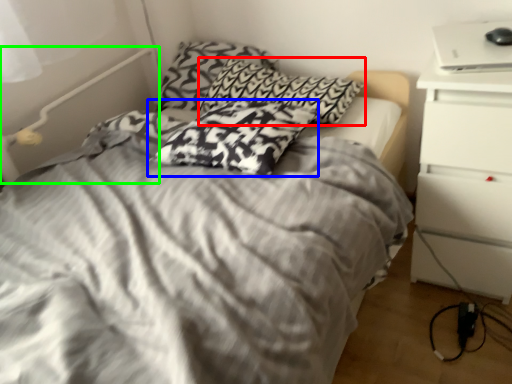
Question: Estimate the real-world distances between objects in this image. Which object is closer to pillow (highlighted by a red box), pillow (highlighted by a blue box) or bed frame (highlighted by a green box)?

Choices:
 (A) pillow
 (B) bed frame

Answer: (A)